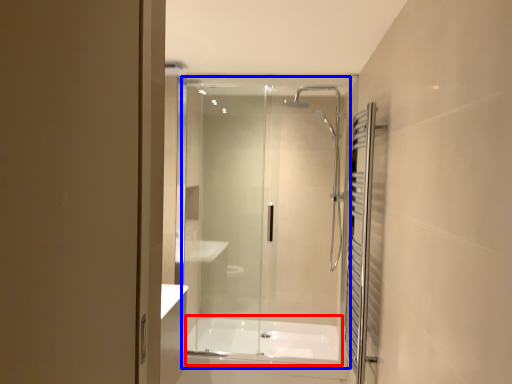
Question: Which of the following is the farthest to the observer, bath (highlighted by a red box) or glass door (highlighted by a blue box)?

Choices:
 (A) bath
 (B) glass door

Answer: (A)